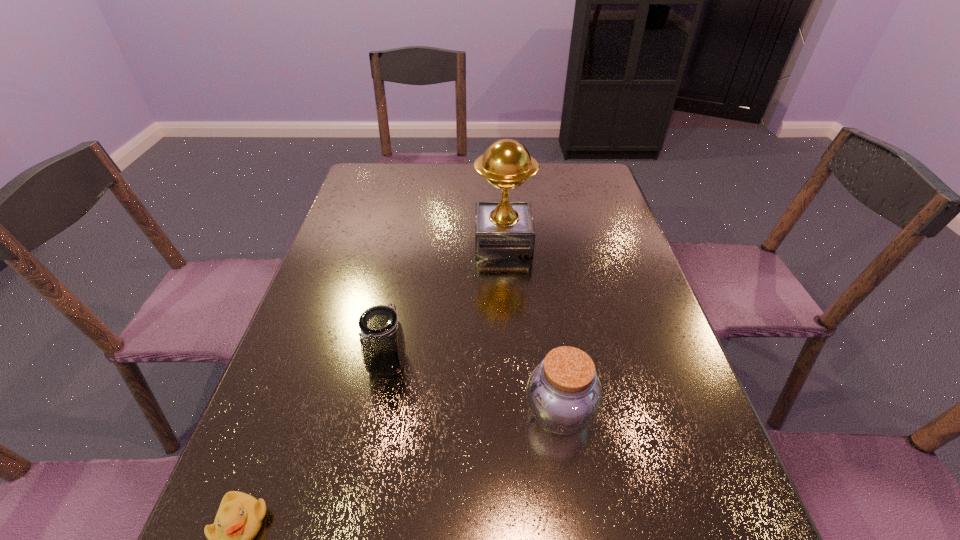
Select which object appears as the closest to the shortest object. Please provide its 2D coordinates. Your answer should be formatted as a tuple, i.e. [(x, y)], where the tuple contains the x and y coordinates of a point satisfying the conditions above.

[(382, 340)]

In order to click on object that stands as the closest to the farthest object in this screenshot , I will do `click(382, 340)`.

The image size is (960, 540). I want to click on free spot that satisfies the following two spatial constraints: 1. on the lid of the nearer jar; 2. on the right side of the farther jar, so click(x=377, y=413).

Where is `vacant space that satisfies the following two spatial constraints: 1. on the front-facing side of the farthest object; 2. on the back side of the nearer jar`? vacant space that satisfies the following two spatial constraints: 1. on the front-facing side of the farthest object; 2. on the back side of the nearer jar is located at coordinates (515, 413).

At what (x,y) coordinates should I click in order to perform the action: click on vacant region that satisfies the following two spatial constraints: 1. on the front-facing side of the tallest object; 2. on the lid of the second farthest object. Please return your answer as a coordinate pair (x, y). Looking at the image, I should click on (511, 363).

The image size is (960, 540). In order to click on free space that satisfies the following two spatial constraints: 1. on the lid of the left jar; 2. on the left side of the nearer jar in this screenshot , I will do `click(377, 413)`.

The height and width of the screenshot is (540, 960). I want to click on vacant space that satisfies the following two spatial constraints: 1. on the front-facing side of the farthest object; 2. on the lid of the third nearest object, so click(x=511, y=363).